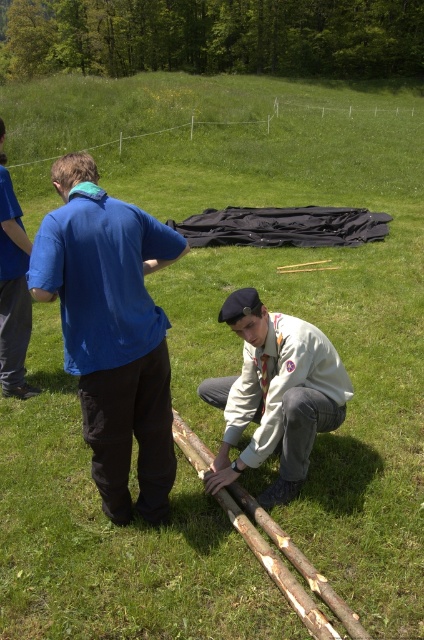
From the picture: You are a photographer standing at the camera position. You want to take a photo of the white matte uniform at center. According to the coordinates provided, where should you aim your camera?

The white matte uniform at center is located at coordinates point (275, 394), so you should aim your camera at that point to capture it.

You are a photographer positioned at the edge of the field. You want to take a photo that includes both the blue cotton shirt at center and the white matte uniform at center. Based on their positions, which subject will appear closer to the camera in the photo?

The blue cotton shirt at center appears closer to the camera because it is in front of the white matte uniform at center.